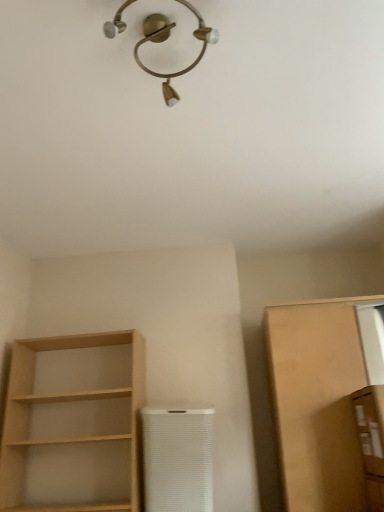
Question: Can you confirm if brown cardboard box at right, the second cabinetry viewed from the back, is thinner than light wood shelf at left?

Choices:
 (A) no
 (B) yes

Answer: (B)

Question: Is brown cardboard box at right, which is the first cabinetry from front to back, not inside light wood shelf at left?

Choices:
 (A) yes
 (B) no

Answer: (A)

Question: Can you confirm if brown cardboard box at right, which is the first cabinetry from front to back, is positioned to the right of light wood shelf at left?

Choices:
 (A) yes
 (B) no

Answer: (A)

Question: Does brown cardboard box at right, which is the first cabinetry from front to back, have a greater height compared to light wood shelf at left?

Choices:
 (A) no
 (B) yes

Answer: (A)

Question: Is brown cardboard box at right, which is the first cabinetry from front to back, in front of light wood shelf at left?

Choices:
 (A) no
 (B) yes

Answer: (B)

Question: Is the depth of brown cardboard box at right, the second cabinetry viewed from the back, greater than that of light wood shelf at left?

Choices:
 (A) yes
 (B) no

Answer: (B)

Question: From the image's perspective, is white textured air purifier at center on matte brown cabinet at right, acting as the 2th cabinetry starting from the front?

Choices:
 (A) yes
 (B) no

Answer: (B)

Question: Considering the relative sizes of white textured air purifier at center and matte brown cabinet at right, the first cabinetry viewed from the back, in the image provided, is white textured air purifier at center taller than matte brown cabinet at right, the first cabinetry viewed from the back,?

Choices:
 (A) no
 (B) yes

Answer: (A)

Question: Does white textured air purifier at center come in front of matte brown cabinet at right, the first cabinetry viewed from the back?

Choices:
 (A) yes
 (B) no

Answer: (B)

Question: Can matte brown cabinet at right, the first cabinetry viewed from the back, be found inside white textured air purifier at center?

Choices:
 (A) yes
 (B) no

Answer: (B)

Question: From the image's perspective, is white textured air purifier at center beneath matte brown cabinet at right, the first cabinetry viewed from the back?

Choices:
 (A) yes
 (B) no

Answer: (A)

Question: Does white textured air purifier at center turn towards matte brown cabinet at right, the first cabinetry viewed from the back?

Choices:
 (A) no
 (B) yes

Answer: (A)

Question: From the image's perspective, is brown cardboard box at right, which is the first cabinetry from front to back, above white textured air purifier at center?

Choices:
 (A) yes
 (B) no

Answer: (A)